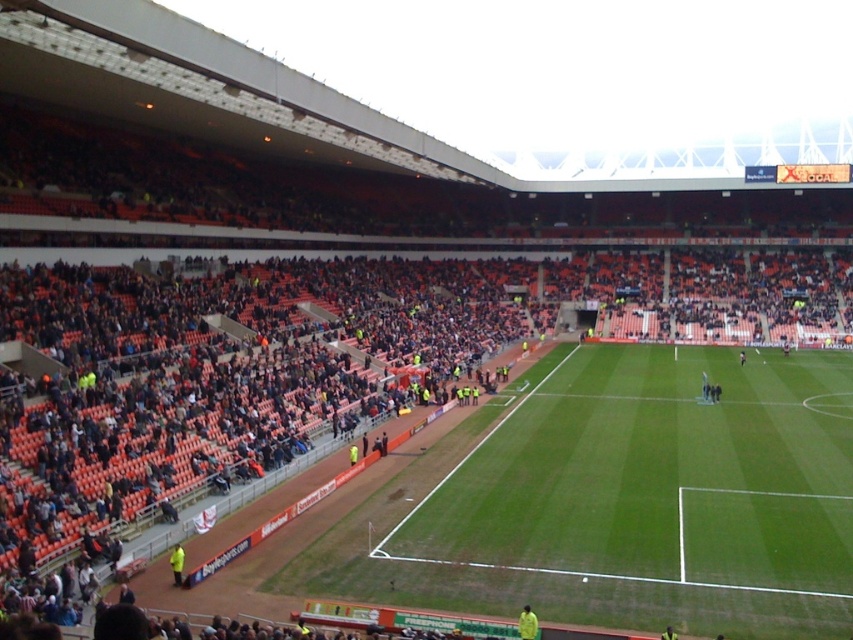
You are a drone operator asked to capture aerial footage of the soccer stadium. The stadium has a green grass football field at center and a point marked at coordinate (660,480). Where would this point be located in relation to the field?

The point at coordinate (660,480) is located on the green grass football field at center, as indicated by the description.

Looking at this image, you are a photographer standing at the edge of the soccer stadium, wanting to capture both the green grass football field at center and the yellow matte jacket at lower center in a single shot. Given that your camera has a fixed focal length, which object should you frame first to ensure both are visible without cropping?

The green grass football field at center is wider than the yellow matte jacket at lower center, so you should frame the green grass football field at center first to ensure both objects are fully visible in the shot.

You are a drone operator tasked with capturing aerial footage of the soccer stadium. Your camera is currently positioned at the point marked by coordinates point (x=660, y=480). What is the primary object directly beneath your camera?

The point (x=660, y=480) marks the green grass football field at center, so the primary object directly beneath the camera is the green grass football field at center.